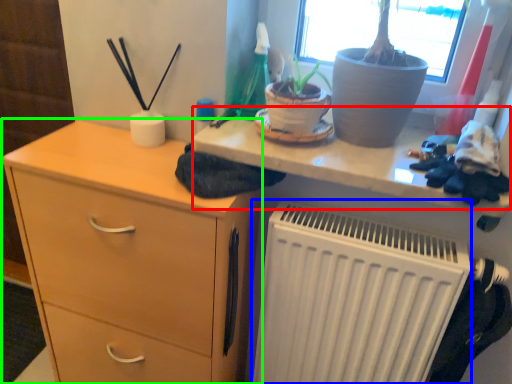
Question: Based on their relative distances, which object is farther from writing desk (highlighted by a red box)? Choose from radiator (highlighted by a blue box) and chest of drawers (highlighted by a green box).

Choices:
 (A) radiator
 (B) chest of drawers

Answer: (B)